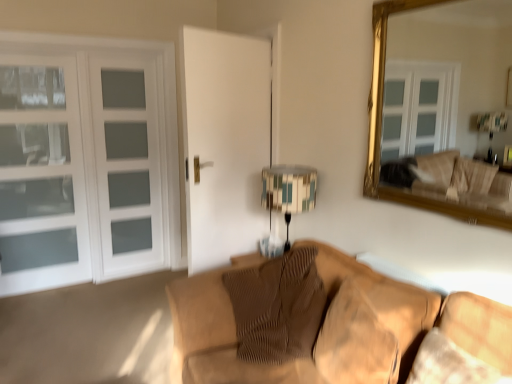
Question: Is white glass door at left beside patterned fabric lampshade at center?

Choices:
 (A) no
 (B) yes

Answer: (A)

Question: From a real-world perspective, is white glass door at left on top of patterned fabric lampshade at center?

Choices:
 (A) yes
 (B) no

Answer: (A)

Question: From the image's perspective, would you say white glass door at left is shown under patterned fabric lampshade at center?

Choices:
 (A) yes
 (B) no

Answer: (B)

Question: Does white glass door at left come behind patterned fabric lampshade at center?

Choices:
 (A) no
 (B) yes

Answer: (B)

Question: Does white glass door at left have a greater width compared to patterned fabric lampshade at center?

Choices:
 (A) yes
 (B) no

Answer: (B)

Question: In terms of width, does white glass door at left look wider or thinner when compared to gold-framed mirror at upper right?

Choices:
 (A) thin
 (B) wide

Answer: (B)

Question: Would you say white glass door at left is inside or outside gold-framed mirror at upper right?

Choices:
 (A) inside
 (B) outside

Answer: (B)

Question: From a real-world perspective, is white glass door at left above or below gold-framed mirror at upper right?

Choices:
 (A) below
 (B) above

Answer: (A)

Question: From their relative heights in the image, would you say white glass door at left is taller or shorter than gold-framed mirror at upper right?

Choices:
 (A) tall
 (B) short

Answer: (A)

Question: Do you think textured beige swivel chair at lower right is within brown textured pillow at center, or outside of it?

Choices:
 (A) outside
 (B) inside

Answer: (A)

Question: Is textured beige swivel chair at lower right bigger or smaller than brown textured pillow at center?

Choices:
 (A) small
 (B) big

Answer: (A)

Question: From their relative heights in the image, would you say textured beige swivel chair at lower right is taller or shorter than brown textured pillow at center?

Choices:
 (A) tall
 (B) short

Answer: (B)

Question: In the image, is textured beige swivel chair at lower right positioned in front of or behind brown textured pillow at center?

Choices:
 (A) behind
 (B) front

Answer: (B)

Question: From a real-world perspective, is brown textured pillow at center positioned above or below textured beige swivel chair at lower right?

Choices:
 (A) above
 (B) below

Answer: (B)

Question: Looking at their shapes, would you say brown textured pillow at center is wider or thinner than textured beige swivel chair at lower right?

Choices:
 (A) wide
 (B) thin

Answer: (A)